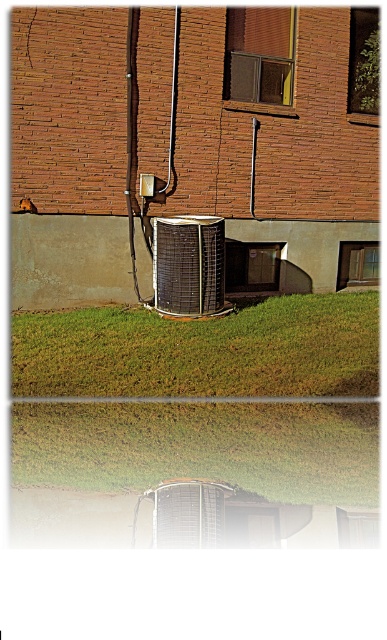
Can you confirm if green grass at lower center is positioned to the right of metallic grid air conditioner at center?

Yes, green grass at lower center is to the right of metallic grid air conditioner at center.

Between green grass at lower center and metallic grid air conditioner at center, which one is positioned lower?

Positioned lower is green grass at lower center.

Is point (97, 362) less distant than point (195, 316)?

That is True.

Where is `green grass at lower center`? Image resolution: width=387 pixels, height=640 pixels. green grass at lower center is located at coordinates (203, 349).